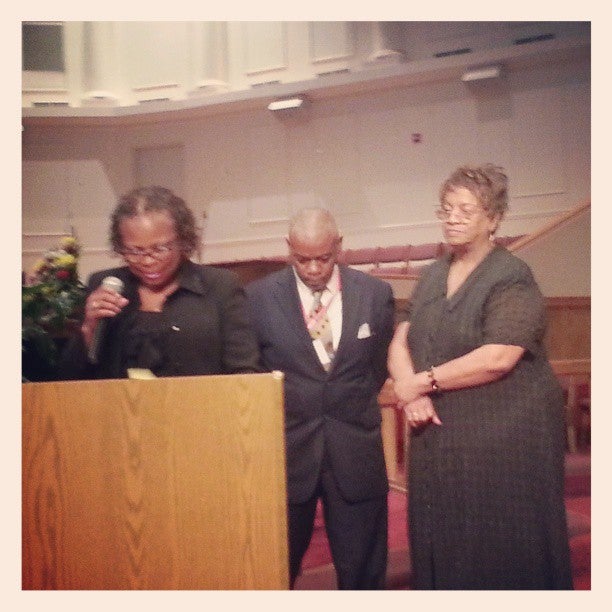
Find the location of a particular element. The height and width of the screenshot is (612, 612). chair is located at coordinates (397, 251), (359, 255), (426, 245).